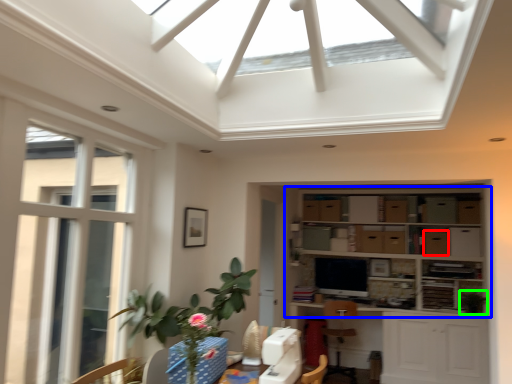
Question: Which is nearer to the cabinetry (highlighted by a red box)? shelf (highlighted by a blue box) or plant (highlighted by a green box).

Choices:
 (A) shelf
 (B) plant

Answer: (A)